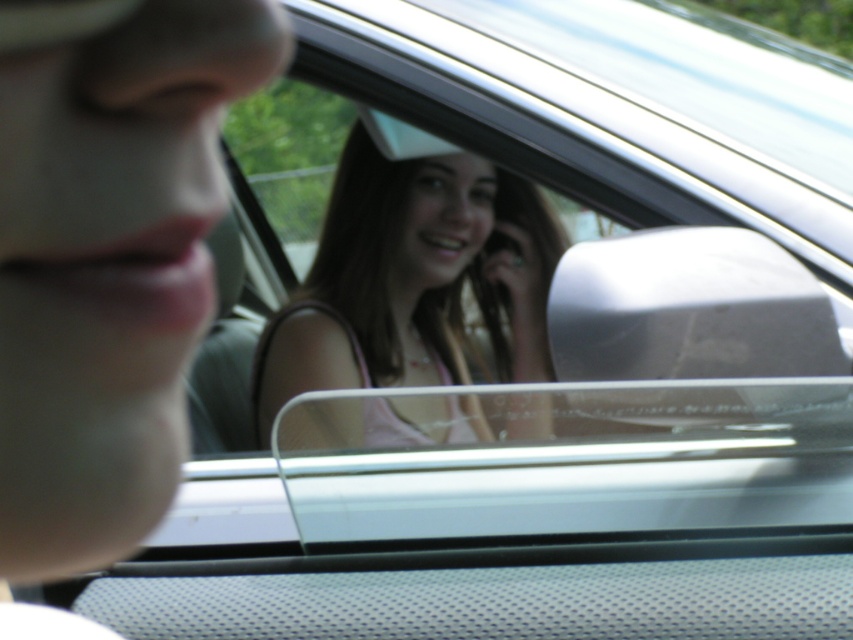
Question: Is matte skin at left to the left of pink fabric at center from the viewer's perspective?

Choices:
 (A) yes
 (B) no

Answer: (A)

Question: Does matte skin at left appear on the left side of pink fabric at center?

Choices:
 (A) yes
 (B) no

Answer: (A)

Question: Does matte skin at left have a larger size compared to pink fabric at center?

Choices:
 (A) no
 (B) yes

Answer: (A)

Question: Which of the following is the farthest from the observer?

Choices:
 (A) (368, 248)
 (B) (62, 461)

Answer: (A)

Question: Which object is farther from the camera taking this photo?

Choices:
 (A) matte skin at left
 (B) pink fabric at center

Answer: (B)